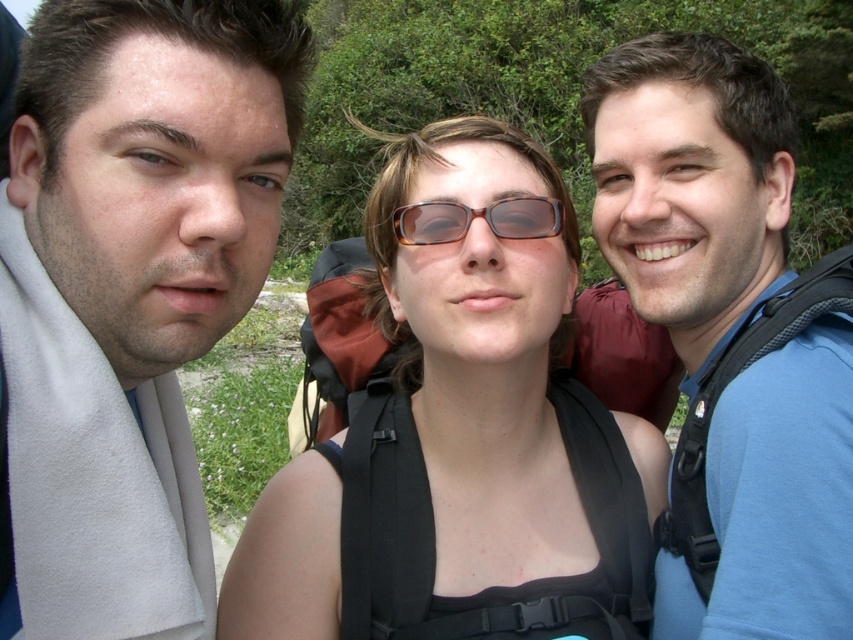
Question: Does smooth gray towel at left appear under blue fabric backpack at center?

Choices:
 (A) yes
 (B) no

Answer: (A)

Question: Estimate the real-world distances between objects in this image. Which object is farther from the smooth gray towel at left?

Choices:
 (A) matte black backpack at center
 (B) tortoiseshell plastic glasses at center
 (C) blue fabric backpack at center

Answer: (C)

Question: Based on their relative distances, which object is nearer to the blue fabric backpack at center?

Choices:
 (A) matte black backpack at center
 (B) smooth gray towel at left

Answer: (A)

Question: Which of these objects is positioned closest to the tortoiseshell plastic glasses at center?

Choices:
 (A) smooth gray towel at left
 (B) matte black backpack at center

Answer: (B)

Question: Is smooth gray towel at left to the left of tortoiseshell plastic glasses at center from the viewer's perspective?

Choices:
 (A) no
 (B) yes

Answer: (B)

Question: Can you confirm if smooth gray towel at left is positioned below matte black backpack at center?

Choices:
 (A) yes
 (B) no

Answer: (B)